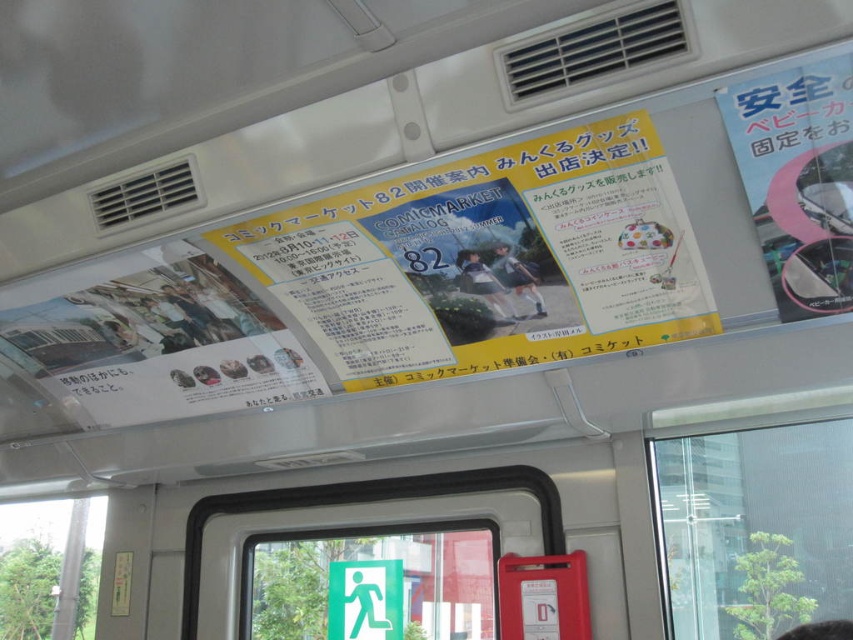
Question: Is green glossy exit sign at center further to the viewer compared to matte black skirt at center?

Choices:
 (A) yes
 (B) no

Answer: (A)

Question: Is the position of transparent glass window at lower left more distant than that of matte black skirt at center?

Choices:
 (A) no
 (B) yes

Answer: (B)

Question: Considering the real-world distances, which object is closest to the matte black skirt at center?

Choices:
 (A) transparent glass window at upper center
 (B) yellow paper poster at upper center
 (C) white paper poster at upper right
 (D) green glossy exit sign at center

Answer: (B)

Question: Based on their relative distances, which object is farther from the transparent glass window at upper center?

Choices:
 (A) white paper poster at upper right
 (B) green glossy exit sign at center

Answer: (B)

Question: Which object is the farthest from the matte gray skirt at center?

Choices:
 (A) white paper poster at upper right
 (B) yellow paper poster at upper center
 (C) transparent glass window at lower left
 (D) green glossy exit sign at center

Answer: (C)

Question: Does transparent glass window at upper center appear over transparent glass window at lower left?

Choices:
 (A) no
 (B) yes

Answer: (B)